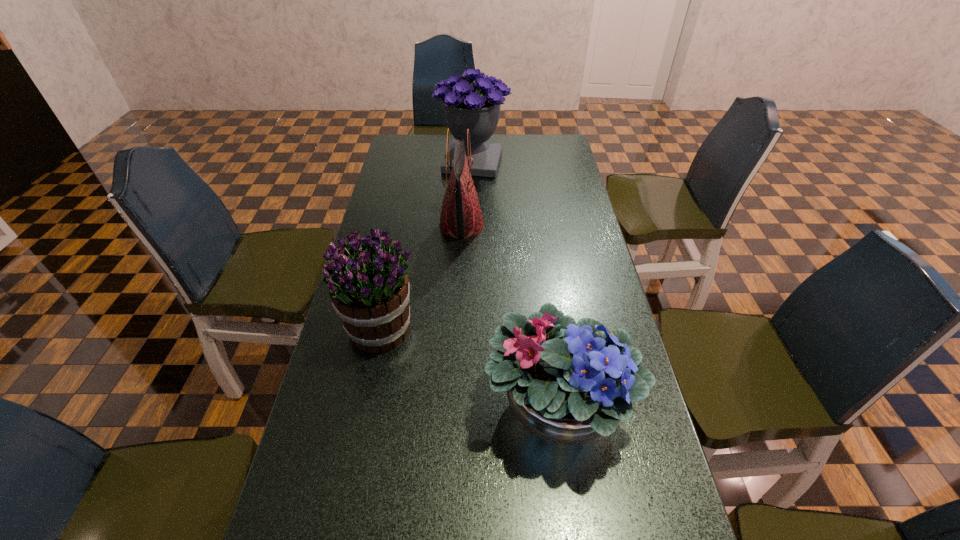
Where is `the farthest object`? Image resolution: width=960 pixels, height=540 pixels. the farthest object is located at coordinates (477, 108).

Locate an element on the screen. the farthest bouquet is located at coordinates (477, 108).

Where is `the third nearest object`? The image size is (960, 540). the third nearest object is located at coordinates (461, 216).

Identify the location of the second tallest bouquet. Image resolution: width=960 pixels, height=540 pixels. (369, 288).

Image resolution: width=960 pixels, height=540 pixels. Find the location of `the shortest bouquet`. the shortest bouquet is located at coordinates (567, 383).

The width and height of the screenshot is (960, 540). In order to click on blank space located on the front of the farthest object in this screenshot , I will do `click(472, 188)`.

Identify the location of free spot located 0.300m on the back of the third nearest object. This screenshot has height=540, width=960. (465, 163).

Image resolution: width=960 pixels, height=540 pixels. I want to click on vacant point located 0.350m on the front of the second shortest bouquet, so click(x=344, y=514).

At what (x,y) coordinates should I click in order to perform the action: click on blank space located 0.400m on the back of the shortest bouquet. Please return your answer as a coordinate pair (x, y). Looking at the image, I should click on (535, 248).

Find the location of a particular element. object present at the far edge is located at coordinates (477, 108).